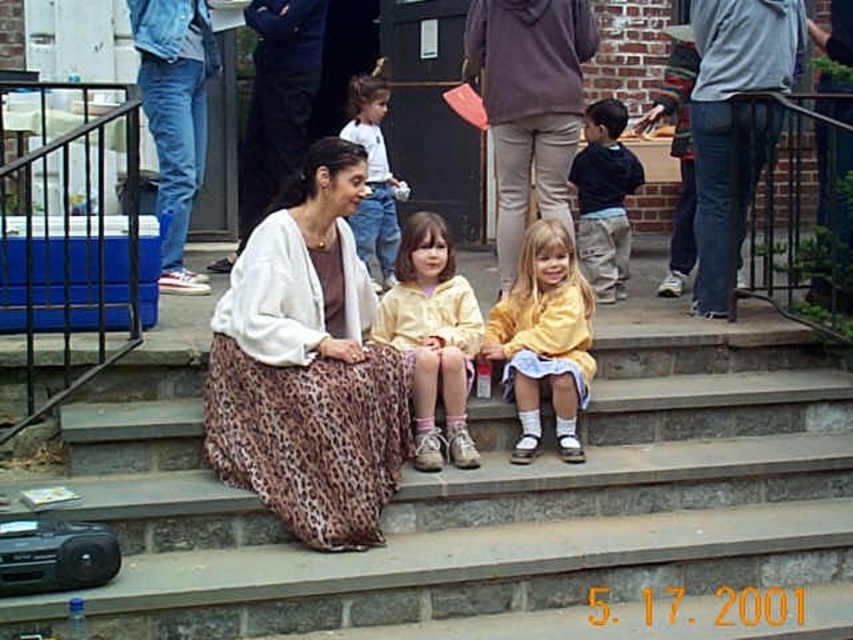
You are trying to decide which clothing item to choose for a casual outdoor event. Based on the image, which clothing item is shorter in length between the yellow matte dress at center and the dark blue shirt at right?

The yellow matte dress at center is shorter than the dark blue shirt at right, so the yellow matte dress at center would be the shorter option.

You are organizing a clothing display and need to place the leopard print skirt at center and the matte brown hoodie at center side by side. Based on their sizes, which one should you allocate more space for?

The leopard print skirt at center has a larger width than the matte brown hoodie at center, so you should allocate more space for the leopard print skirt at center.